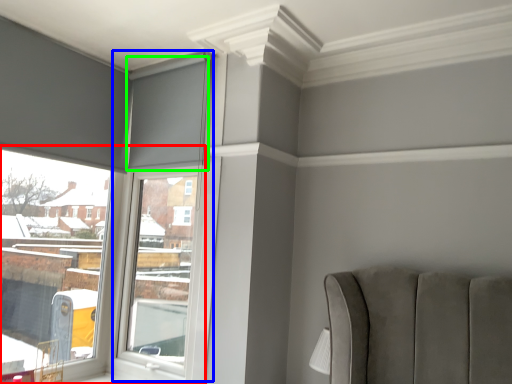
Question: Based on their relative distances, which object is farther from window (highlighted by a red box)? Choose from window frame (highlighted by a blue box) and curtain (highlighted by a green box).

Choices:
 (A) window frame
 (B) curtain

Answer: (B)